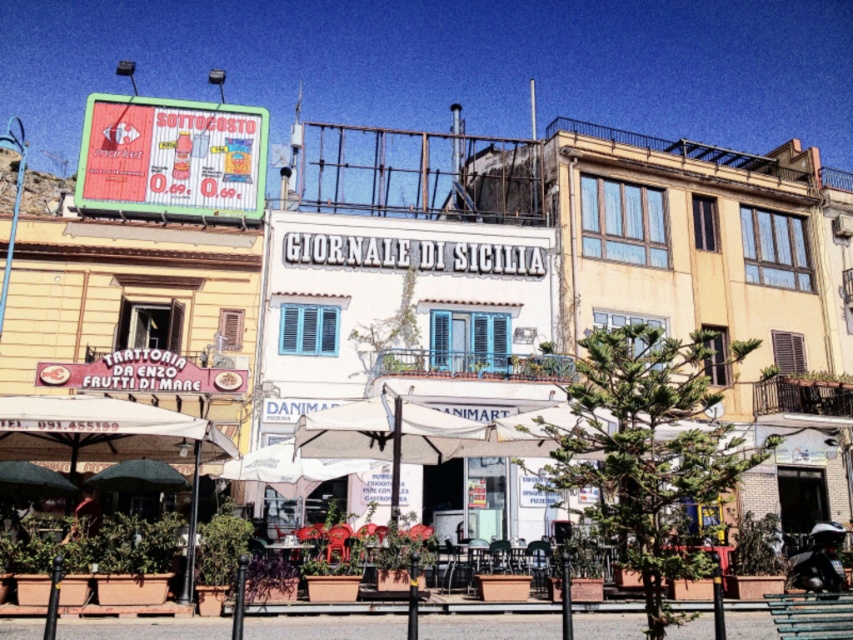
Question: Which object is closer to the camera taking this photo?

Choices:
 (A) green painted wood park bench at lower right
 (B) green fabric umbrella at lower left

Answer: (A)

Question: Is the position of green painted wood park bench at lower right more distant than that of green fabric umbrella at lower left?

Choices:
 (A) yes
 (B) no

Answer: (B)

Question: Which point is closer to the camera?

Choices:
 (A) green fabric umbrella at lower left
 (B) green painted wood park bench at lower right

Answer: (B)

Question: Is green painted wood park bench at lower right smaller than green fabric umbrella at lower left?

Choices:
 (A) yes
 (B) no

Answer: (B)

Question: Can you confirm if green painted wood park bench at lower right is wider than green fabric umbrella at lower left?

Choices:
 (A) no
 (B) yes

Answer: (B)